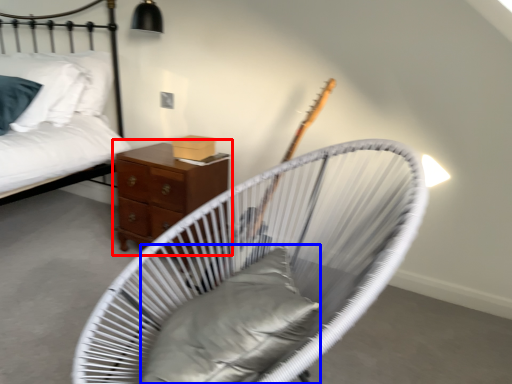
Question: Among these objects, which one is nearest to the camera, nightstand (highlighted by a red box) or pillow (highlighted by a blue box)?

Choices:
 (A) nightstand
 (B) pillow

Answer: (B)